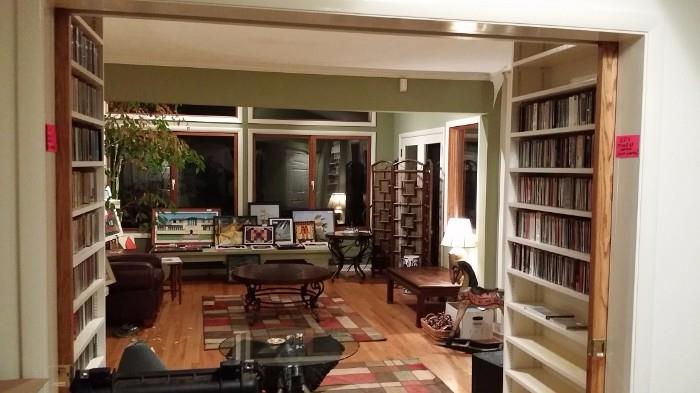
Image resolution: width=700 pixels, height=393 pixels. I want to click on circular glass table, so click(315, 347).